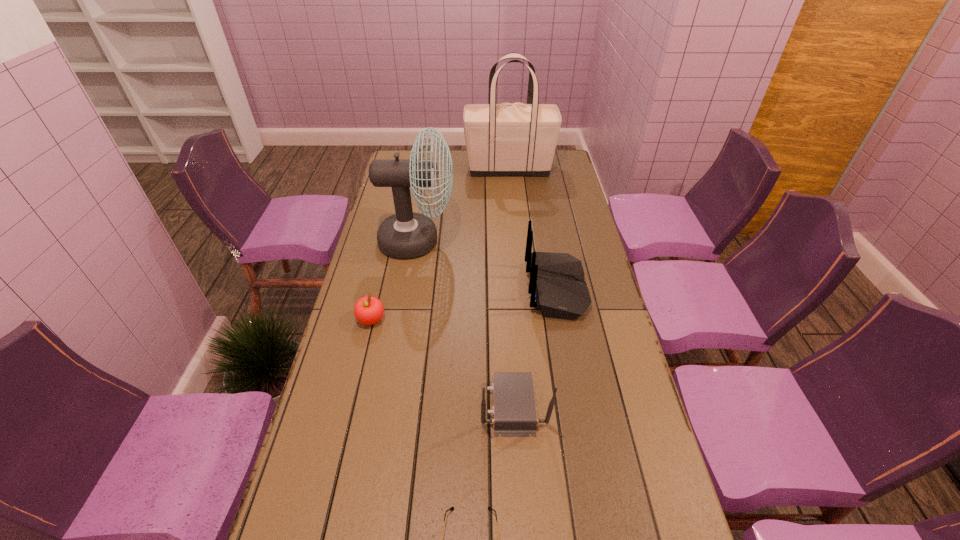
Locate an element on the screen. router that is at the right edge is located at coordinates (557, 287).

Locate an element on the screen. This screenshot has width=960, height=540. object that is at the far right corner is located at coordinates (517, 139).

At what (x,y) coordinates should I click in order to perform the action: click on vacant space at the far edge. Please return your answer as a coordinate pair (x, y). The height and width of the screenshot is (540, 960). Looking at the image, I should click on (466, 157).

Where is `free spot at the left edge of the desktop`? Image resolution: width=960 pixels, height=540 pixels. free spot at the left edge of the desktop is located at coordinates (412, 209).

Where is `free location at the right edge of the desktop`? Image resolution: width=960 pixels, height=540 pixels. free location at the right edge of the desktop is located at coordinates (577, 347).

Locate an element on the screen. vacant space at the far right corner is located at coordinates (560, 172).

Find the location of a particular element. The image size is (960, 540). free space between the fifth tallest object and the shopping bag is located at coordinates (441, 244).

Find the location of a particular element. free area in between the fan and the nearer router is located at coordinates (466, 323).

This screenshot has height=540, width=960. I want to click on free space that is in between the nearer router and the farther router, so click(535, 347).

Locate an element on the screen. Image resolution: width=960 pixels, height=540 pixels. empty space that is in between the apple and the farther router is located at coordinates (464, 305).